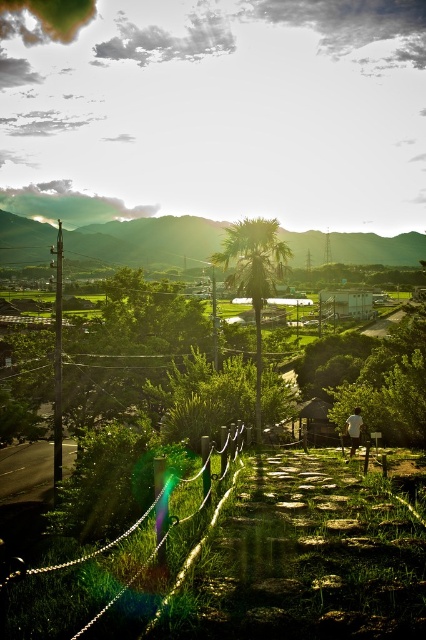
You are standing at the stone pathway bordered by the wooden fence and want to walk towards the green grassy hillside at center. Is the white cotton shirt at lower right blocking your path?

The green grassy hillside at center might be wider than the white cotton shirt at lower right, so the shirt may not block your path completely. However, since the exact width isn